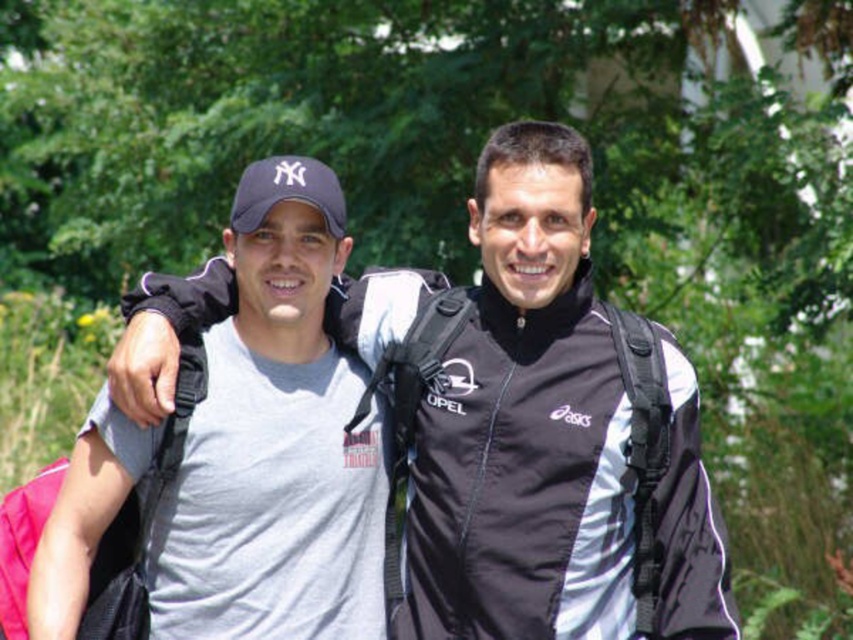
Question: Which point is farther to the camera?

Choices:
 (A) matte black jacket at center
 (B) gray cotton t-shirt at left

Answer: (B)

Question: Estimate the real-world distances between objects in this image. Which object is closer to the gray cotton t-shirt at left?

Choices:
 (A) matte black jacket at center
 (B) matte blue baseball cap at left

Answer: (B)

Question: Can you confirm if matte black jacket at center is positioned to the left of gray cotton t-shirt at left?

Choices:
 (A) no
 (B) yes

Answer: (A)

Question: Does matte black jacket at center have a greater width compared to gray cotton t-shirt at left?

Choices:
 (A) yes
 (B) no

Answer: (A)

Question: Does matte black jacket at center have a smaller size compared to gray cotton t-shirt at left?

Choices:
 (A) no
 (B) yes

Answer: (A)

Question: Which point is closer to the camera?

Choices:
 (A) (258, 216)
 (B) (186, 589)
 (C) (664, 529)

Answer: (C)